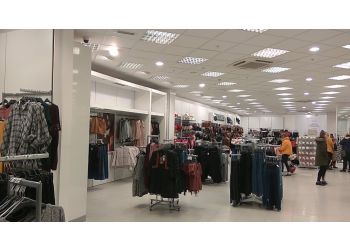
The image size is (350, 250). In order to click on clothing hanger in this screenshot , I will do `click(19, 200)`, `click(37, 95)`.